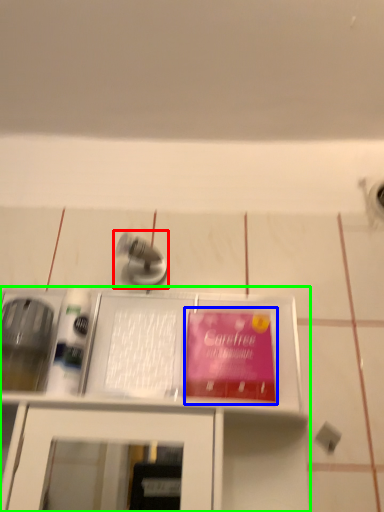
Question: Estimate the real-world distances between objects in this image. Which object is farther from tap (highlighted by a red box), paperback book (highlighted by a blue box) or furniture (highlighted by a green box)?

Choices:
 (A) paperback book
 (B) furniture

Answer: (B)